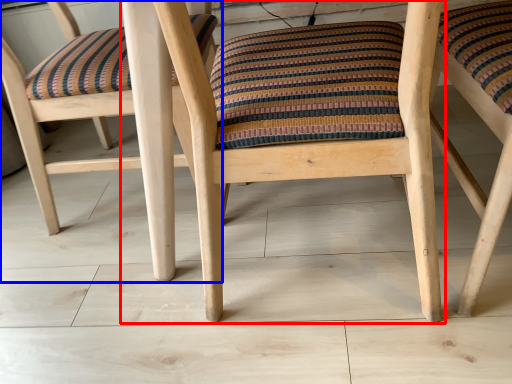
Question: Which of the following is the closest to the observer, chair (highlighted by a red box) or chair (highlighted by a blue box)?

Choices:
 (A) chair
 (B) chair

Answer: (A)